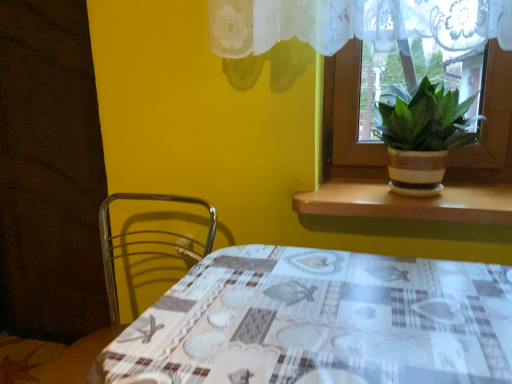
The width and height of the screenshot is (512, 384). What do you see at coordinates (322, 320) in the screenshot?
I see `plaid fabric table at center` at bounding box center [322, 320].

Identify the location of brown wood at upper right. coord(408,202).

Is brown wood at upper right positioned far away from brown striped pot at window?

They are positioned close to each other.

Can you confirm if brown wood at upper right is smaller than brown striped pot at window?

Yes.

Considering the sizes of brown wood at upper right and brown striped pot at window in the image, is brown wood at upper right taller or shorter than brown striped pot at window?

Considering their sizes, brown wood at upper right has less height than brown striped pot at window.

Consider the image. Can you confirm if plaid fabric table at center is wider than brown striped pot at window?

Indeed, plaid fabric table at center has a greater width compared to brown striped pot at window.

Consider the image. From a real-world perspective, who is located lower, plaid fabric table at center or brown striped pot at window?

plaid fabric table at center is physically lower.

From the picture: Between plaid fabric table at center and brown striped pot at window, which one appears on the right side from the viewer's perspective?

From the viewer's perspective, brown striped pot at window appears more on the right side.

Considering the sizes of objects plaid fabric table at center and brown wood at upper right in the image provided, who is thinner, plaid fabric table at center or brown wood at upper right?

Thinner between the two is brown wood at upper right.

Looking at this image, is plaid fabric table at center bigger than brown wood at upper right?

Indeed, plaid fabric table at center has a larger size compared to brown wood at upper right.

From a real-world perspective, between plaid fabric table at center and brown wood at upper right, who is vertically lower?

plaid fabric table at center is physically lower.

The image size is (512, 384). Find the location of `table lying below the brown wood at upper right (from the image's perspective)`. table lying below the brown wood at upper right (from the image's perspective) is located at coordinates (322, 320).

Which is more to the right, brown wood at upper right or metallic wire chair at lower left?

brown wood at upper right.

Can you confirm if brown wood at upper right is bigger than metallic wire chair at lower left?

No, brown wood at upper right is not bigger than metallic wire chair at lower left.

From the image's perspective, which object appears higher, brown wood at upper right or metallic wire chair at lower left?

brown wood at upper right is shown above in the image.

Would you consider brown wood at upper right to be distant from metallic wire chair at lower left?

brown wood at upper right is near metallic wire chair at lower left, not far away.

In the scene shown: Considering the sizes of brown striped pot at window and metallic wire chair at lower left in the image, is brown striped pot at window bigger or smaller than metallic wire chair at lower left?

Clearly, brown striped pot at window is smaller in size than metallic wire chair at lower left.

Consider the image. Does brown striped pot at window have a lesser width compared to metallic wire chair at lower left?

Yes, brown striped pot at window is thinner than metallic wire chair at lower left.

Which point is more forward, (461, 114) or (105, 244)?

Point (461, 114)

Considering the sizes of objects metallic wire chair at lower left and brown wood at upper right in the image provided, who is smaller, metallic wire chair at lower left or brown wood at upper right?

With smaller size is brown wood at upper right.

Which is correct: metallic wire chair at lower left is inside brown wood at upper right, or outside of it?

metallic wire chair at lower left is not inside brown wood at upper right, it's outside.

Is metallic wire chair at lower left oriented away from brown wood at upper right?

No.

Is metallic wire chair at lower left at the left side of brown wood at upper right?

Indeed, metallic wire chair at lower left is positioned on the left side of brown wood at upper right.

How many degrees apart are the facing directions of metallic wire chair at lower left and brown striped pot at window?

0.000913 degrees separate the facing orientations of metallic wire chair at lower left and brown striped pot at window.

Is metallic wire chair at lower left looking in the opposite direction of brown striped pot at window?

No, metallic wire chair at lower left is not facing the opposite direction of brown striped pot at window.

Considering the relative sizes of metallic wire chair at lower left and brown striped pot at window in the image provided, is metallic wire chair at lower left taller than brown striped pot at window?

Yes.

Identify the location of chair located on the left of brown striped pot at window. (110, 295).

The height and width of the screenshot is (384, 512). Identify the location of window sill that appears below the brown striped pot at window (from the image's perspective). (408, 202).

Locate an element on the screen. Image resolution: width=512 pixels, height=384 pixels. houseplant lying above the plaid fabric table at center (from the image's perspective) is located at coordinates (422, 134).

Which object lies nearer to the anchor point plaid fabric table at center, brown striped pot at window or metallic wire chair at lower left?

brown striped pot at window is closer to plaid fabric table at center.

From the picture: From the image, which object appears to be farther from brown wood at upper right, metallic wire chair at lower left or plaid fabric table at center?

metallic wire chair at lower left is further to brown wood at upper right.

Considering their positions, is brown striped pot at window positioned further to metallic wire chair at lower left than plaid fabric table at center?

The object further to metallic wire chair at lower left is brown striped pot at window.

Estimate the real-world distances between objects in this image. Which object is further from brown striped pot at window, metallic wire chair at lower left or plaid fabric table at center?

metallic wire chair at lower left is positioned further to the anchor brown striped pot at window.

Which object lies further to the anchor point metallic wire chair at lower left, plaid fabric table at center or brown striped pot at window?

brown striped pot at window lies further to metallic wire chair at lower left than the other object.

Estimate the real-world distances between objects in this image. Which object is closer to plaid fabric table at center, metallic wire chair at lower left or brown striped pot at window?

brown striped pot at window lies closer to plaid fabric table at center than the other object.

Based on their spatial positions, is brown wood at upper right or plaid fabric table at center closer to metallic wire chair at lower left?

Based on the image, plaid fabric table at center appears to be nearer to metallic wire chair at lower left.

Based on the photo, when comparing their distances from brown striped pot at window, does brown wood at upper right or metallic wire chair at lower left seem closer?

brown wood at upper right.

At what (x,y) coordinates should I click in order to perform the action: click on table between metallic wire chair at lower left and brown striped pot at window. Please return your answer as a coordinate pair (x, y). Image resolution: width=512 pixels, height=384 pixels. Looking at the image, I should click on (322, 320).

Find the location of a particular element. The height and width of the screenshot is (384, 512). window sill between metallic wire chair at lower left and brown striped pot at window is located at coordinates (408, 202).

This screenshot has height=384, width=512. What are the coordinates of `table between metallic wire chair at lower left and brown wood at upper right` in the screenshot? It's located at (322, 320).

Locate an element on the screen. This screenshot has width=512, height=384. houseplant between plaid fabric table at center and brown wood at upper right from front to back is located at coordinates (422, 134).